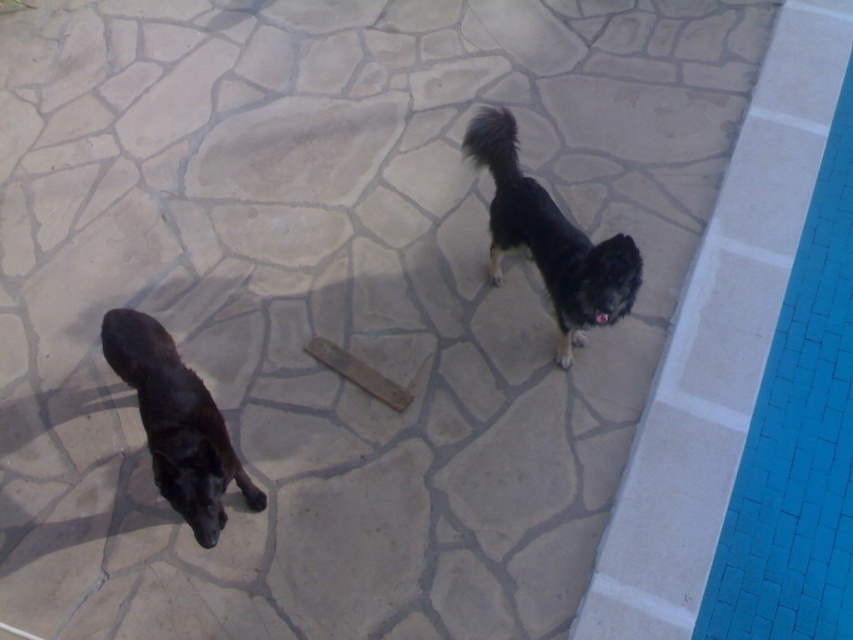
Question: Based on their relative distances, which object is nearer to the black matte dog at lower left?

Choices:
 (A) blue tile swimming pool at right
 (B) black fur dog at upper right

Answer: (B)

Question: Can you confirm if blue tile swimming pool at right is bigger than black matte dog at lower left?

Choices:
 (A) yes
 (B) no

Answer: (A)

Question: Which object is positioned farthest from the blue tile swimming pool at right?

Choices:
 (A) black fur dog at upper right
 (B) black matte dog at lower left
 (C) wooden plank at center

Answer: (B)

Question: Which object is positioned farthest from the wooden plank at center?

Choices:
 (A) black matte dog at lower left
 (B) black fur dog at upper right

Answer: (B)

Question: Is black fur dog at upper right to the left of black matte dog at lower left from the viewer's perspective?

Choices:
 (A) yes
 (B) no

Answer: (B)

Question: Does blue tile swimming pool at right come in front of black fur dog at upper right?

Choices:
 (A) yes
 (B) no

Answer: (B)